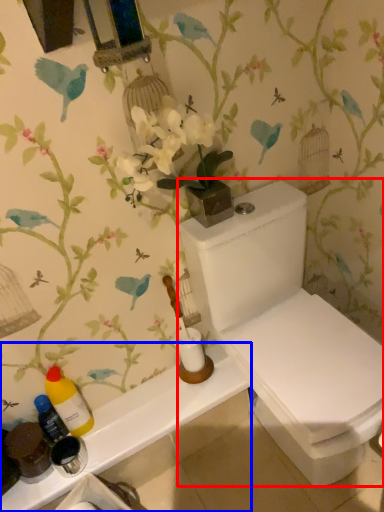
Question: Which of the following is the closest to the observer, toilet (highlighted by a red box) or counter top (highlighted by a blue box)?

Choices:
 (A) toilet
 (B) counter top

Answer: (A)